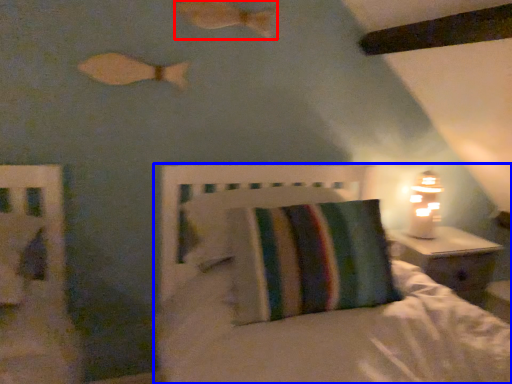
Question: Which of the following is the closest to the observer, fish (highlighted by a red box) or bed (highlighted by a blue box)?

Choices:
 (A) fish
 (B) bed

Answer: (B)